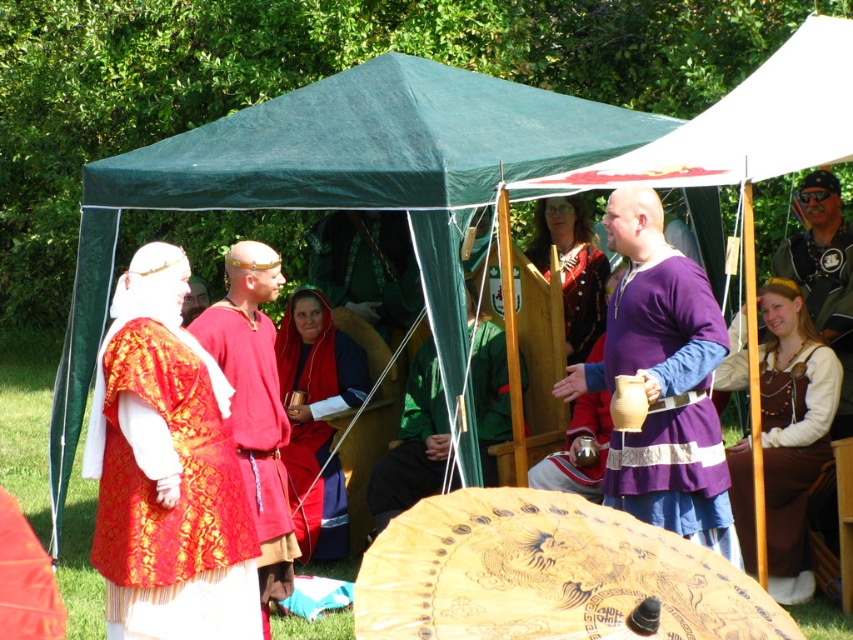
Question: Is green fabric at center closer to camera compared to leather jacket at upper right?

Choices:
 (A) no
 (B) yes

Answer: (A)

Question: Can you confirm if wooden carved umbrella at center is bigger than leather jacket at upper right?

Choices:
 (A) yes
 (B) no

Answer: (B)

Question: Is wooden carved umbrella at center above matte red fabric at center?

Choices:
 (A) yes
 (B) no

Answer: (B)

Question: Considering the real-world distances, which object is closest to the purple matte tunic at center?

Choices:
 (A) matte red fabric at center
 (B) leather jacket at upper right

Answer: (B)

Question: Which is nearer to the purple fabric shirt at right?

Choices:
 (A) matte red fabric at center
 (B) purple matte tunic at center
 (C) wooden carved umbrella at center
 (D) brown leather apron at right

Answer: (D)

Question: Which of these objects is positioned closest to the wooden carved umbrella at center?

Choices:
 (A) brown leather apron at right
 (B) green fabric at center

Answer: (A)